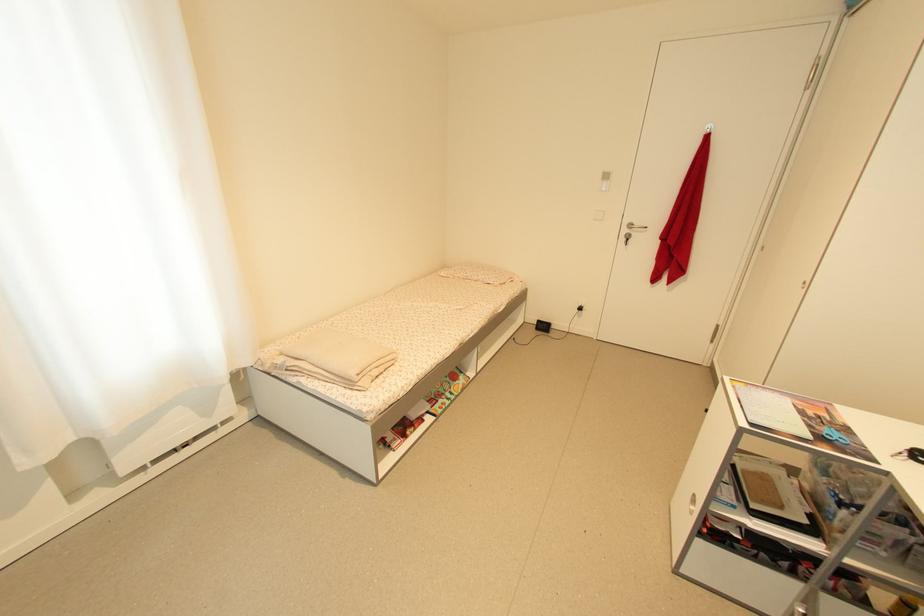
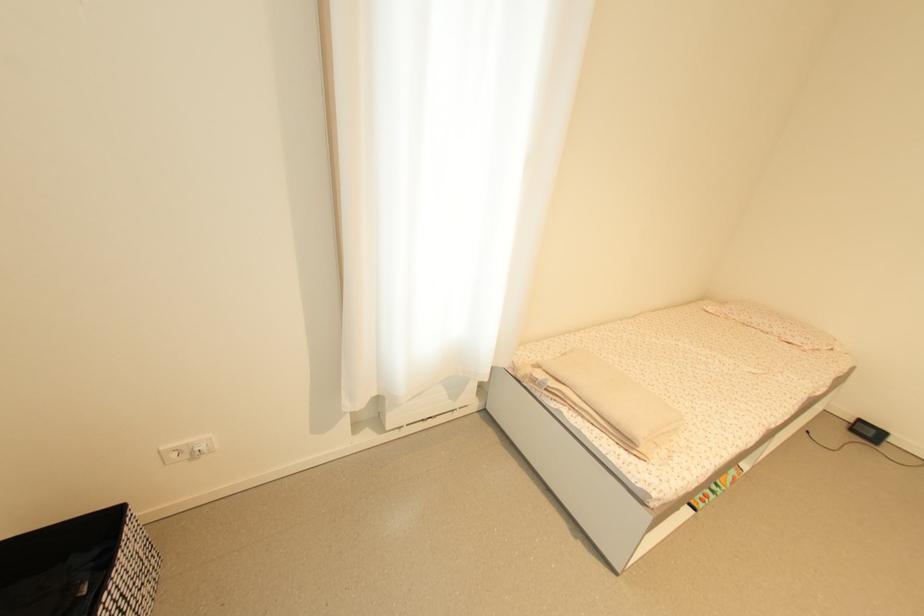
Question: The camera is either moving clockwise (left) or counter-clockwise (right) around the object. The first image is from the beginning of the video and the second image is from the end. Is the camera moving left or right when shooting the video?

Choices:
 (A) Left
 (B) Right

Answer: (B)